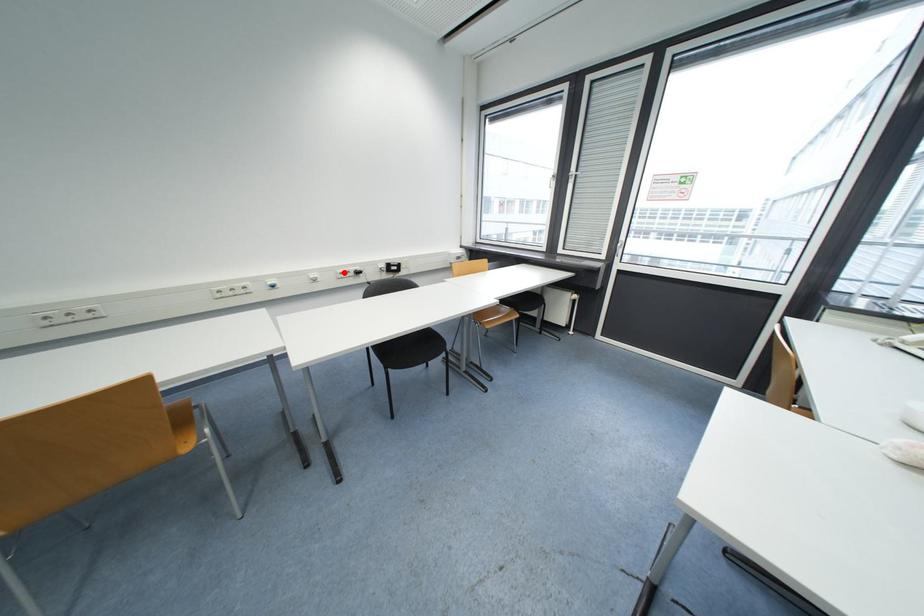
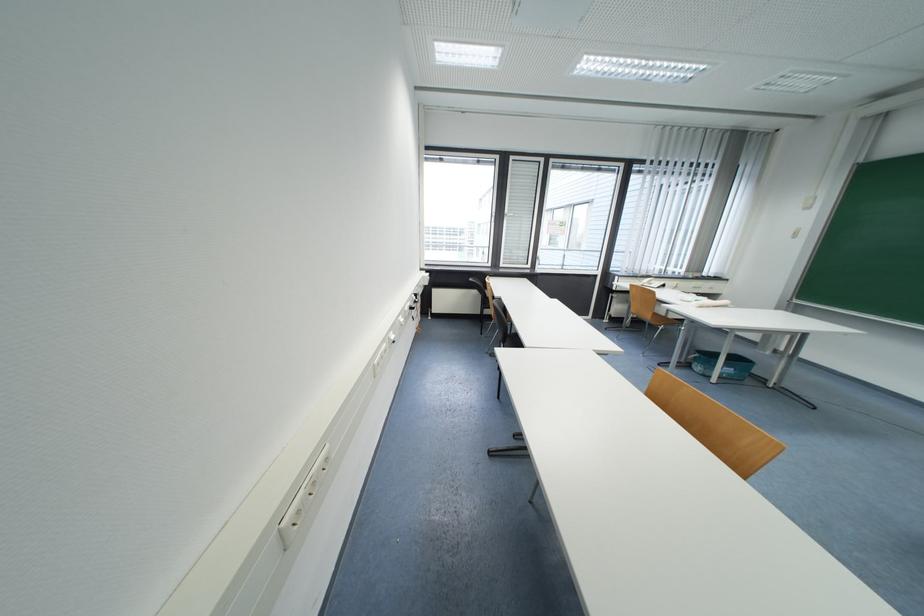
In the second image, find the point that corresponds to the highlighted location in the first image.

(411, 310)